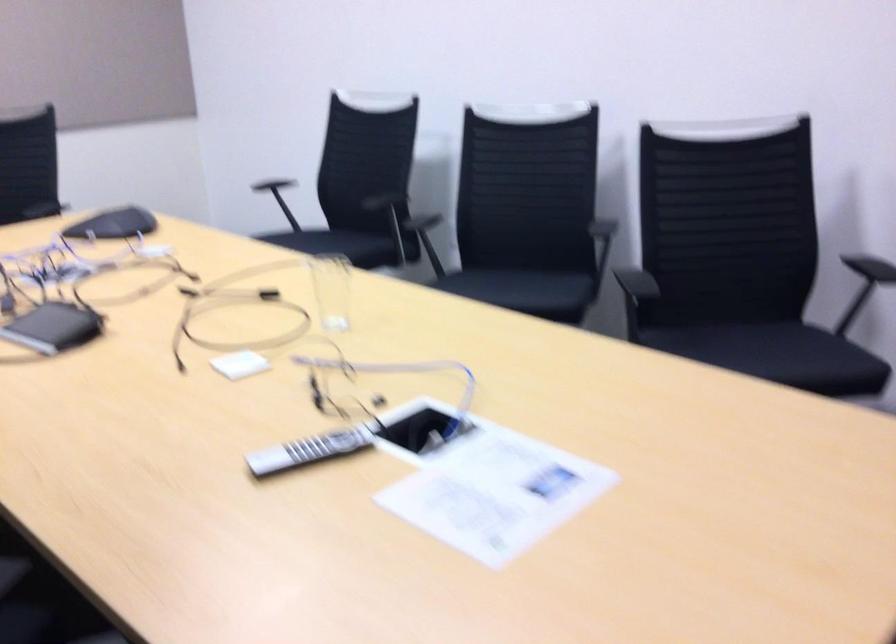
Where would you tap the black tablet? Please return your answer as a coordinate pair (x, y).

(419, 430)